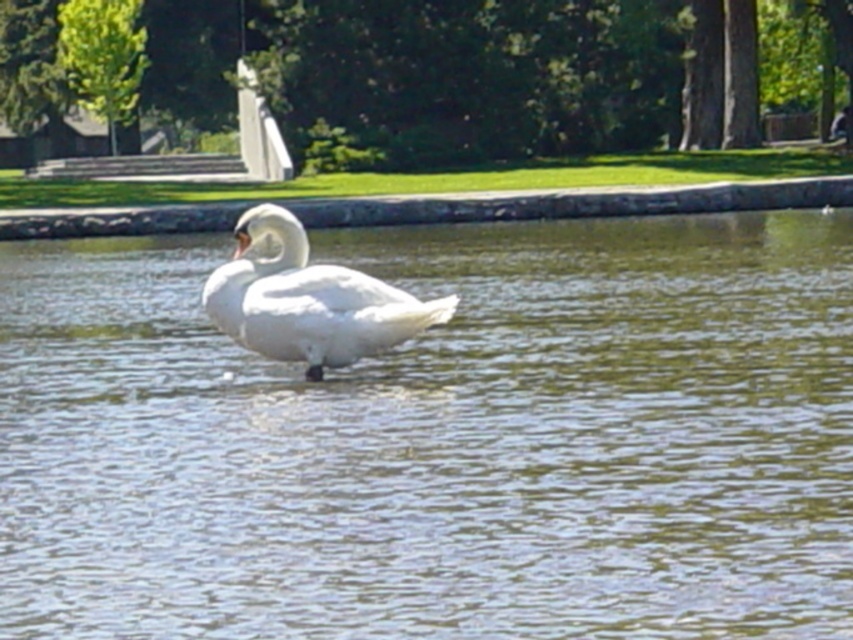
Question: Which of the following is the farthest from the observer?

Choices:
 (A) clear water at center
 (B) white smooth swan at center
 (C) white feathered swan at center

Answer: (C)

Question: Can you confirm if clear water at center is smaller than white smooth swan at center?

Choices:
 (A) yes
 (B) no

Answer: (B)

Question: Which is farther from the clear water at center?

Choices:
 (A) white smooth swan at center
 (B) white feathered swan at center

Answer: (B)

Question: Based on their relative distances, which object is farther from the clear water at center?

Choices:
 (A) white feathered swan at center
 (B) white smooth swan at center

Answer: (A)

Question: Does clear water at center come in front of white smooth swan at center?

Choices:
 (A) no
 (B) yes

Answer: (B)

Question: Observing the image, what is the correct spatial positioning of clear water at center in reference to white smooth swan at center?

Choices:
 (A) above
 (B) below

Answer: (A)